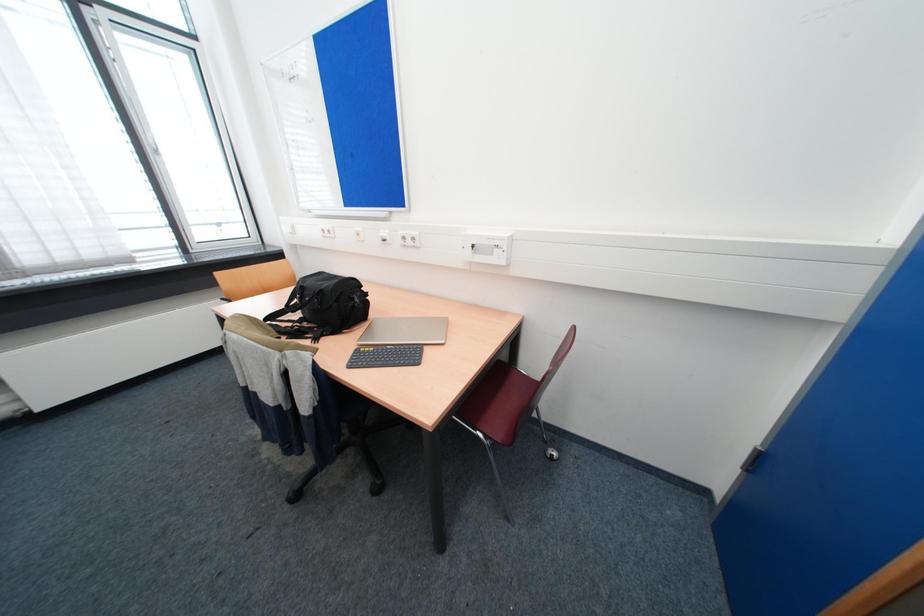
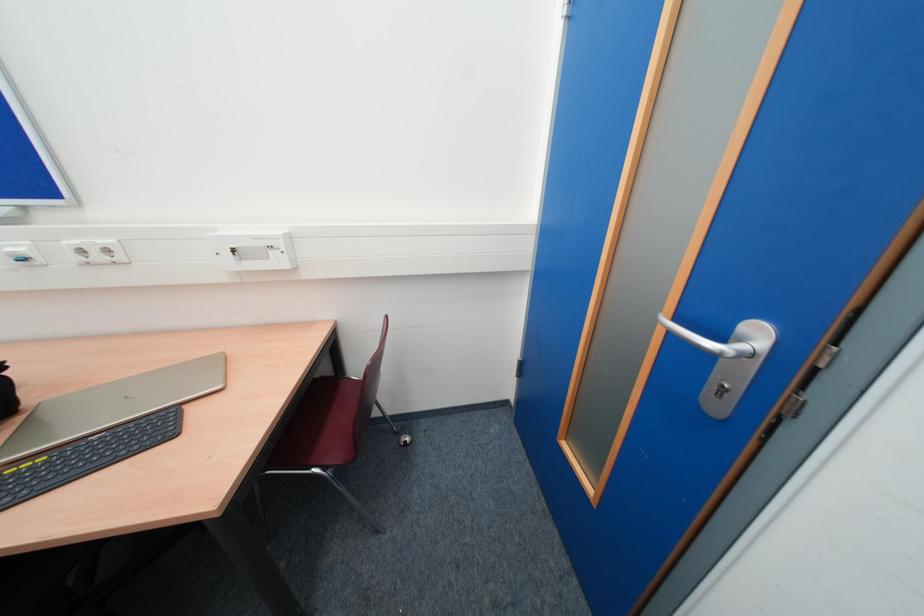
Question: Based on the continuous images, in which direction is the camera rotating? Reply with the corresponding letter.

Choices:
 (A) Left
 (B) Right
 (C) Up
 (D) Down

Answer: (B)